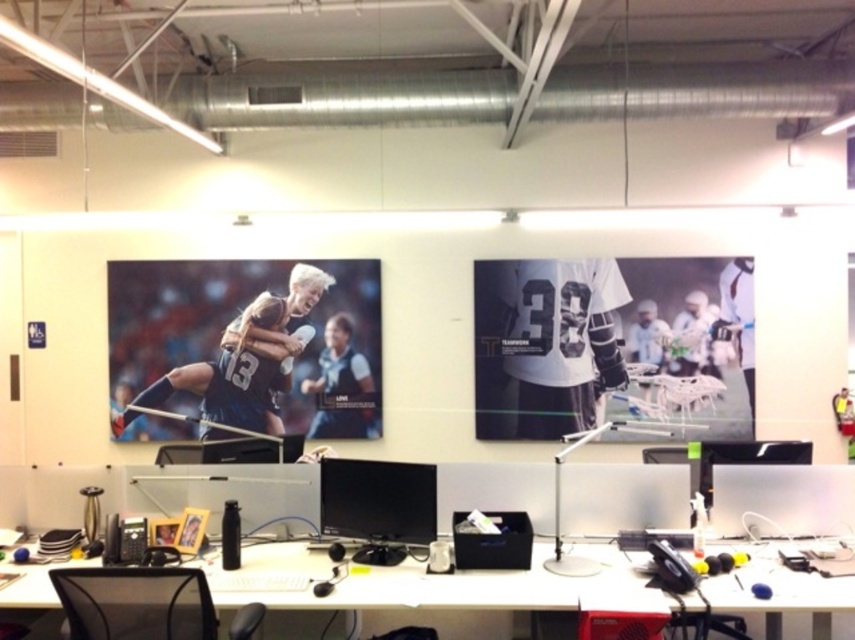
You are setting up a new monitor in an office. The white plastic computer desk at center is where you want to place the transparent plastic monitor at center. Considering the space between them, can you fit a keyboard that is 16 inches wide between the desk and the monitor?

The white plastic computer desk at center is 16.26 inches from the transparent plastic monitor at center. Since the keyboard is 16 inches wide, there is just enough space to fit it between them with a small gap remaining.

You are setting up a desk in the office described. You have two monitors, the black glossy monitor at center and the matte black monitor at center. Which monitor will require more desk space vertically?

The black glossy monitor at center has a greater height compared to the matte black monitor at center, so it will require more desk space vertically.

You are an office worker who needs to place a new keyboard on the white plastic computer desk at center. However, there is a transparent plastic monitor at center in the way. Can you place the keyboard on the desk without moving the monitor?

The white plastic computer desk at center is closer to the viewer than the transparent plastic monitor at center, so yes, you can place the keyboard on the desk without moving the monitor because the desk is in front of the monitor and provides space for the keyboard.